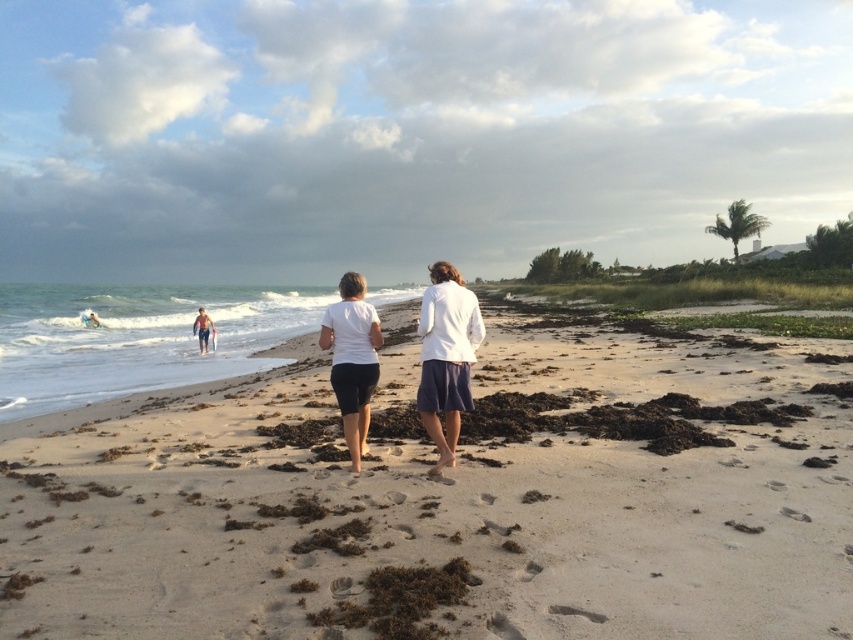
Question: From the image, what is the correct spatial relationship of white cotton shirt at center in relation to white matte shorts at center?

Choices:
 (A) right
 (B) left

Answer: (A)

Question: Which of the following is the farthest from the observer?

Choices:
 (A) white cotton shirts at center
 (B) light brown sand at center

Answer: (A)

Question: Which point is closer to the camera?

Choices:
 (A) (440, 451)
 (B) (596, 400)
 (C) (426, 305)
 (D) (343, 376)

Answer: (C)

Question: Does light brown sand at center appear over white cotton shirts at center?

Choices:
 (A) yes
 (B) no

Answer: (B)

Question: Observing the image, what is the correct spatial positioning of white cotton shirt at center in reference to white matte shorts at center?

Choices:
 (A) left
 (B) right

Answer: (B)

Question: Which object is the closest to the white cotton shirts at center?

Choices:
 (A) light brown sand at center
 (B) white matte shorts at center
 (C) white cotton shirt at center

Answer: (C)